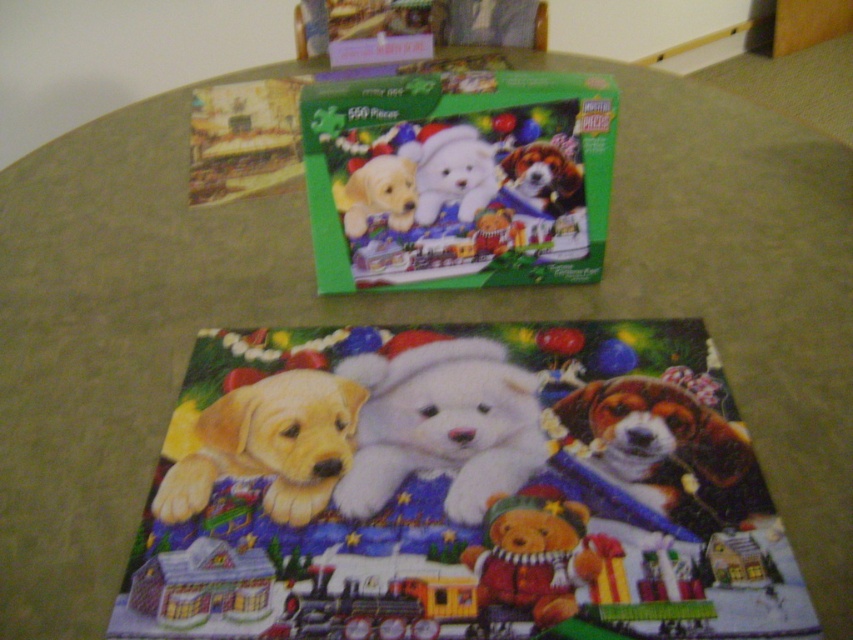
You are organizing a Christmas party and need to place a small gift on the table. The gift must be placed on top of an object. Which object should you choose between the white plush teddy bear at center and the velvety brown teddy bear at lower right?

The white plush teddy bear at center is positioned over the velvety brown teddy bear at lower right, so you should place the gift on the white plush teddy bear at center as it is the top object.

You are organizing a childrens Christmas party and need to place both the velvety brown teddy bear at lower right and the white plush teddy bear at upper center on a shelf. The shelf has limited space. Based on the image, which teddy bear might require more width on the shelf?

The velvety brown teddy bear at lower right might require more width on the shelf since it is wider than the white plush teddy bear at upper center.